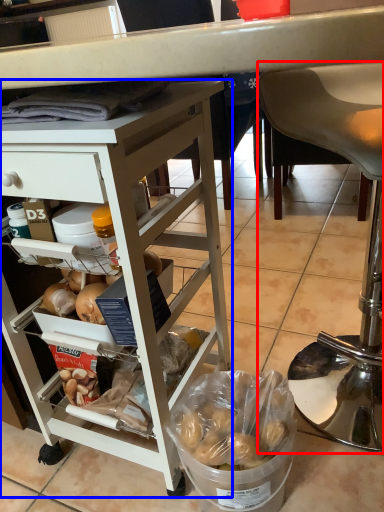
Question: Which of the following is the closest to the observer, chair (highlighted by a red box) or desk (highlighted by a blue box)?

Choices:
 (A) chair
 (B) desk

Answer: (B)